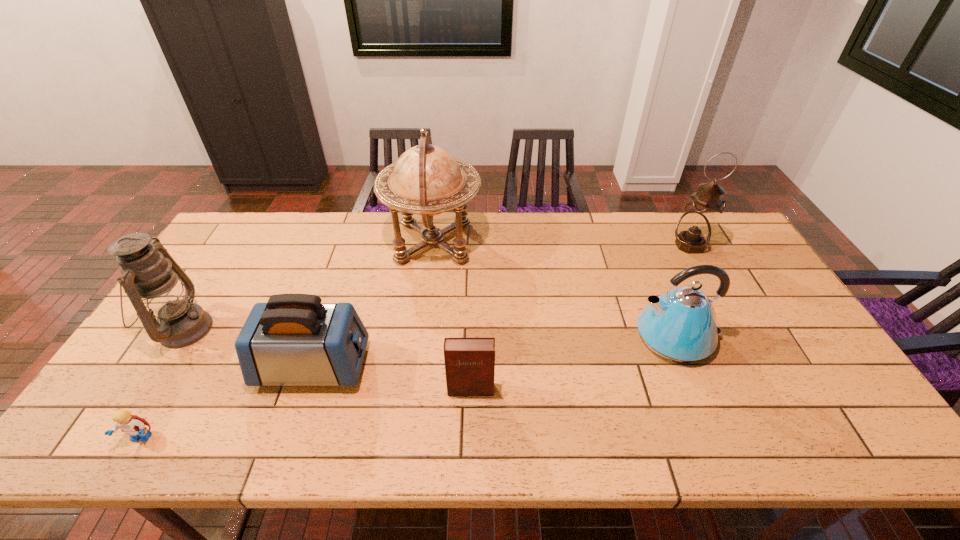
Where is `the tallest object`? This screenshot has height=540, width=960. the tallest object is located at coordinates (427, 180).

Locate an element on the screen. the right oil lamp is located at coordinates (694, 230).

Find the location of a particular element. Image resolution: width=960 pixels, height=540 pixels. the nearer oil lamp is located at coordinates (155, 284).

Where is `kettle`? The image size is (960, 540). kettle is located at coordinates (680, 325).

The height and width of the screenshot is (540, 960). What are the coordinates of `toaster` in the screenshot? It's located at (292, 340).

Where is `diary`? diary is located at coordinates (469, 362).

Where is `Lego`? The image size is (960, 540). Lego is located at coordinates (132, 425).

The image size is (960, 540). I want to click on the shortest object, so click(132, 425).

This screenshot has width=960, height=540. Find the location of `free point located 0.360m on the front-facing side of the tallest object`. free point located 0.360m on the front-facing side of the tallest object is located at coordinates (586, 242).

You are a GUI agent. You are given a task and a screenshot of the screen. Output one action in this format:
    pyautogui.click(x=<x>, y=<y>)
    Task: Click on the vacant space located 0.290m on the front of the farther oil lamp
    This screenshot has height=540, width=960.
    Given the screenshot: What is the action you would take?
    pyautogui.click(x=731, y=322)